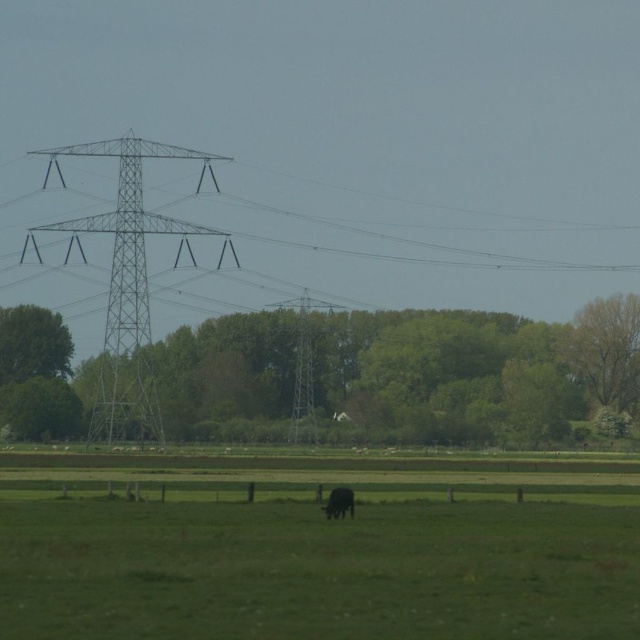
Question: Which of these objects is positioned closest to the metallic silver tower at center?

Choices:
 (A) green grass pasture at lower center
 (B) black furry cow at lower center

Answer: (A)

Question: Does green grass pasture at lower center lie behind black furry cow at lower center?

Choices:
 (A) no
 (B) yes

Answer: (A)

Question: Can you confirm if green grass pasture at lower center is bigger than metallic gray tower at left?

Choices:
 (A) yes
 (B) no

Answer: (A)

Question: Does metallic gray tower at left appear on the right side of metallic silver tower at center?

Choices:
 (A) no
 (B) yes

Answer: (A)

Question: Which point is closer to the camera?

Choices:
 (A) green grass pasture at lower center
 (B) black furry cow at lower center

Answer: (A)

Question: Which point is closer to the camera?

Choices:
 (A) green grass pasture at lower center
 (B) metallic gray tower at left
 (C) metallic silver tower at center
 (D) black furry cow at lower center

Answer: (A)